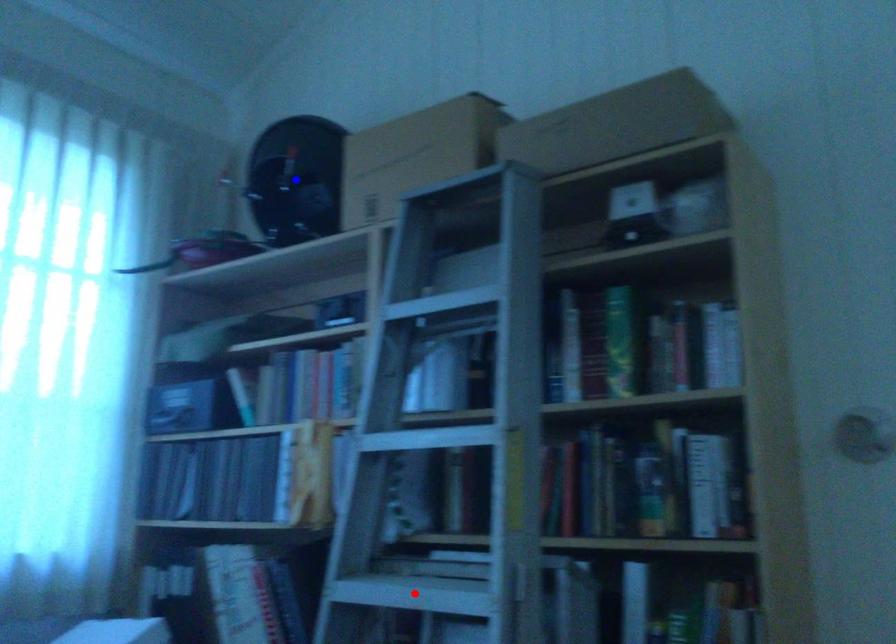
Question: In the image, two points are highlighted. Which point is nearer to the camera? Reply with the corresponding letter.

Choices:
 (A) blue point
 (B) red point

Answer: (B)